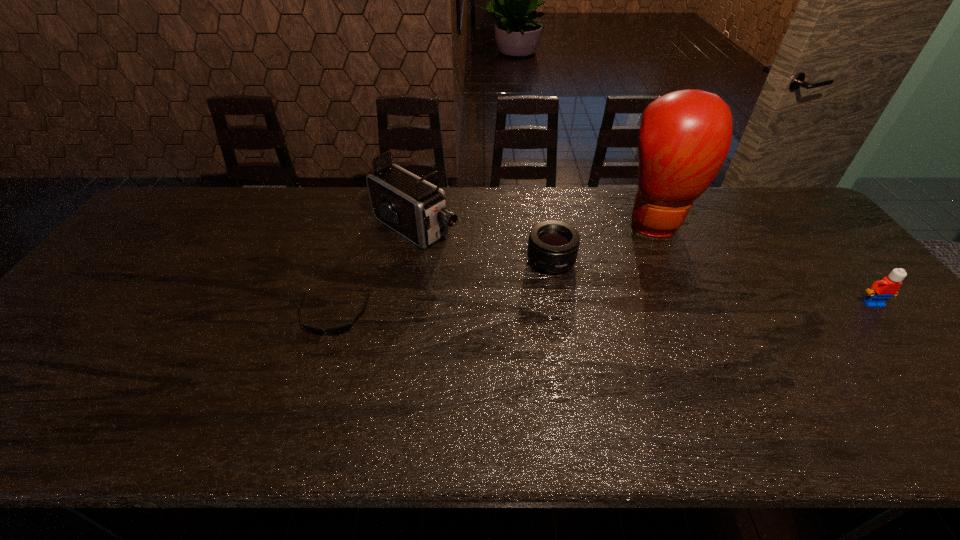
Locate an element on the screen. The width and height of the screenshot is (960, 540). free spot on the desktop that is between the shortest object and the third tallest object and is positioned on the side of the fourth tallest object with brand markings and control switches is located at coordinates (528, 312).

This screenshot has height=540, width=960. Identify the location of free spot on the desktop that is between the shortest object and the Lego and is positioned at the lens of the camcorder. (550, 312).

At what (x,y) coordinates should I click in order to perform the action: click on vacant space on the desktop that is between the shortest object and the rightmost object and is positioned on the striking surface of the tallest object. Please return your answer as a coordinate pair (x, y). Looking at the image, I should click on (686, 308).